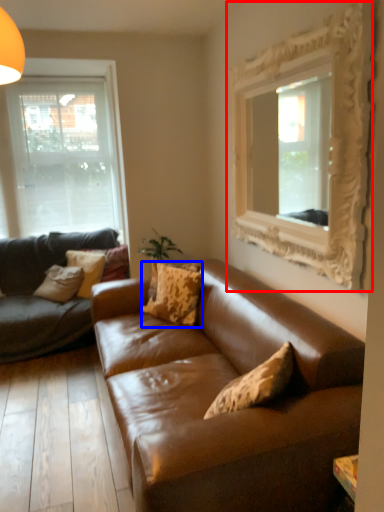
Question: Which object is closer to the camera taking this photo, picture frame (highlighted by a red box) or pillow (highlighted by a blue box)?

Choices:
 (A) picture frame
 (B) pillow

Answer: (A)